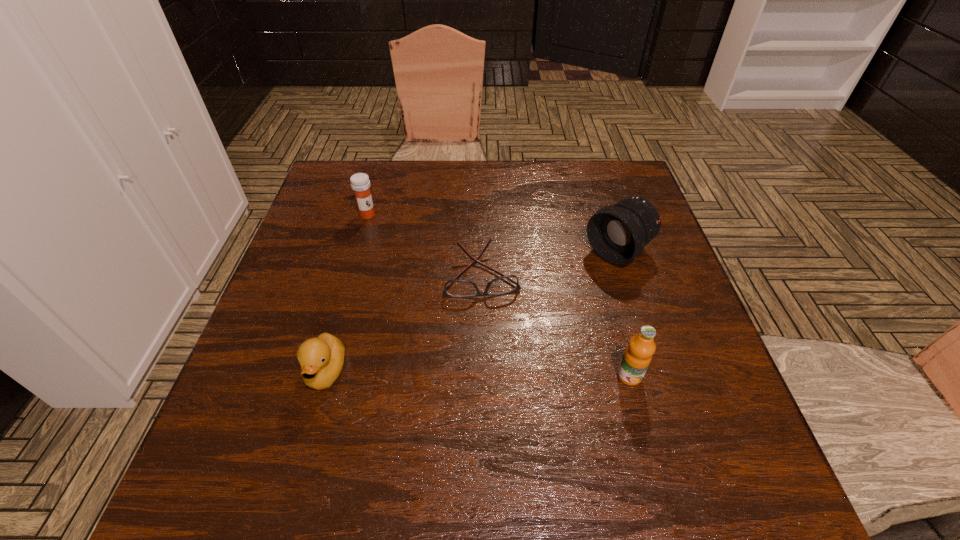
Identify which object is the closest to the telephoto lens. Please provide its 2D coordinates. Your answer should be formatted as a tuple, i.e. [(x, y)], where the tuple contains the x and y coordinates of a point satisfying the conditions above.

[(457, 288)]

This screenshot has height=540, width=960. I want to click on free region that satisfies the following two spatial constraints: 1. on the front side of the telephoto lens; 2. on the right side of the medicine, so (x=357, y=252).